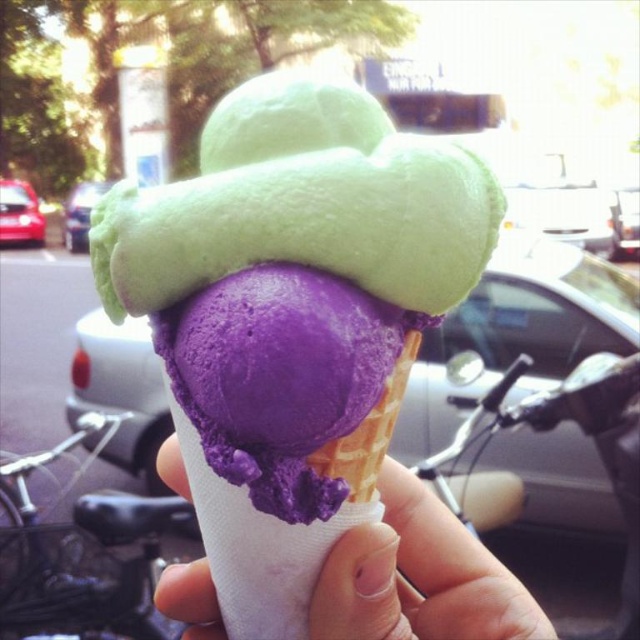
What is the color of the ice cream located at the coordinates point (291, 316) in the image?

The point (291, 316) is on purple matte ice cream at center, so the color is purple.

You are a food critic standing 24 inches away from the purple matte ice cream at center. Can you reach it without moving your position?

The purple matte ice cream at center is 18.28 inches away from the viewer, so yes, you can reach it without moving since you are standing 24 inches away, which is farther than the distance to the ice cream.

You are at an ice cream shop and want to know if the purple matte ice cream at center will fit in the purple matte ice cream cone at center. Can you determine based on their sizes?

The purple matte ice cream at center is much taller than the purple matte ice cream cone at center, so it will not fit properly in the cone.